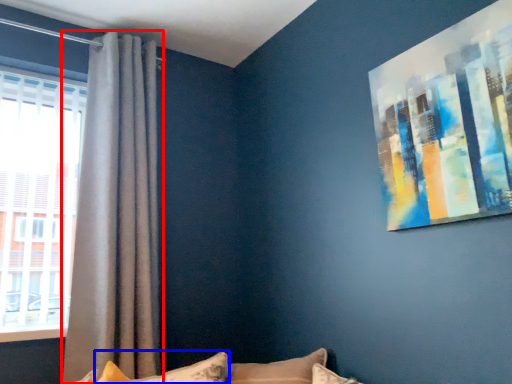
Question: Which point is closer to the camera, curtain (highlighted by a red box) or pillow (highlighted by a blue box)?

Choices:
 (A) curtain
 (B) pillow

Answer: (B)